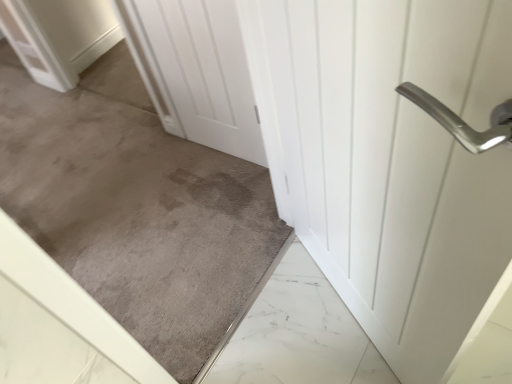
Question: Does white matte door at center, the 2th door positioned from the right, have a greater height compared to gray carpet at center?

Choices:
 (A) no
 (B) yes

Answer: (A)

Question: Is white matte door at center, the 2th door positioned from the right, located outside gray carpet at center?

Choices:
 (A) yes
 (B) no

Answer: (A)

Question: Are white matte door at center, arranged as the 1th door when viewed from the left, and gray carpet at center far apart?

Choices:
 (A) yes
 (B) no

Answer: (B)

Question: Does white matte door at center, the 2th door positioned from the right, have a larger size compared to gray carpet at center?

Choices:
 (A) yes
 (B) no

Answer: (B)

Question: Is white matte door at center, arranged as the 1th door when viewed from the left, aimed at gray carpet at center?

Choices:
 (A) no
 (B) yes

Answer: (A)

Question: Does white matte door at center, arranged as the 1th door when viewed from the left, appear on the right side of gray carpet at center?

Choices:
 (A) yes
 (B) no

Answer: (B)

Question: From a real-world perspective, is white glossy door handle at upper right, the first door when ordered from right to left, positioned under gray carpet at center based on gravity?

Choices:
 (A) no
 (B) yes

Answer: (B)

Question: Does white glossy door handle at upper right, the first door when ordered from right to left, appear on the left side of gray carpet at center?

Choices:
 (A) yes
 (B) no

Answer: (B)

Question: Is white glossy door handle at upper right, the first door when ordered from right to left, positioned with its back to gray carpet at center?

Choices:
 (A) yes
 (B) no

Answer: (A)

Question: From the image's perspective, is white glossy door handle at upper right, the first door when ordered from right to left, located beneath gray carpet at center?

Choices:
 (A) yes
 (B) no

Answer: (A)

Question: Is white glossy door handle at upper right, the second door when ordered from left to right, directly adjacent to gray carpet at center?

Choices:
 (A) yes
 (B) no

Answer: (B)

Question: Would you consider white glossy door handle at upper right, the first door when ordered from right to left, to be distant from gray carpet at center?

Choices:
 (A) yes
 (B) no

Answer: (B)

Question: From the image's perspective, is white matte door at center, arranged as the 1th door when viewed from the left, over white glossy door handle at upper right, the first door when ordered from right to left?

Choices:
 (A) yes
 (B) no

Answer: (A)